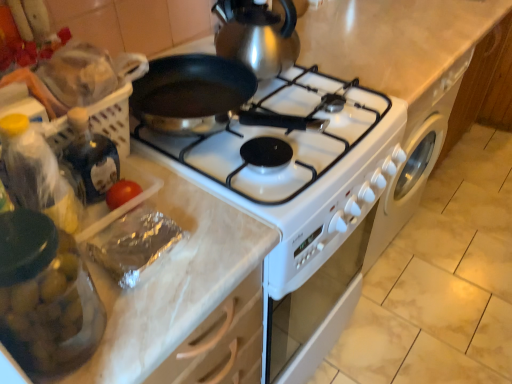
Question: Is translucent plastic bottle at left to the left of transparent glass jar at left from the viewer's perspective?

Choices:
 (A) yes
 (B) no

Answer: (A)

Question: Is translucent plastic bottle at left outside of transparent glass jar at left?

Choices:
 (A) no
 (B) yes

Answer: (B)

Question: Is transparent glass jar at left at the back of translucent plastic bottle at left?

Choices:
 (A) no
 (B) yes

Answer: (A)

Question: Does translucent plastic bottle at left have a lesser width compared to transparent glass jar at left?

Choices:
 (A) yes
 (B) no

Answer: (A)

Question: Is translucent plastic bottle at left not near transparent glass jar at left?

Choices:
 (A) yes
 (B) no

Answer: (B)

Question: In the image, is shiny metallic gas stove at center on the left side or the right side of transparent glass jar at left?

Choices:
 (A) right
 (B) left

Answer: (A)

Question: Considering the positions of point (304, 86) and point (11, 264), is point (304, 86) closer or farther from the camera than point (11, 264)?

Choices:
 (A) farther
 (B) closer

Answer: (A)

Question: Looking at their shapes, would you say shiny metallic gas stove at center is wider or thinner than transparent glass jar at left?

Choices:
 (A) thin
 (B) wide

Answer: (B)

Question: Would you say shiny metallic gas stove at center is inside or outside transparent glass jar at left?

Choices:
 (A) inside
 (B) outside

Answer: (B)

Question: Considering the positions of silver foil meat at lower left and shiny metallic gas stove at center in the image, is silver foil meat at lower left bigger or smaller than shiny metallic gas stove at center?

Choices:
 (A) small
 (B) big

Answer: (A)

Question: Would you say silver foil meat at lower left is to the left or to the right of shiny metallic gas stove at center in the picture?

Choices:
 (A) right
 (B) left

Answer: (B)

Question: In the image, is silver foil meat at lower left positioned in front of or behind shiny metallic gas stove at center?

Choices:
 (A) front
 (B) behind

Answer: (A)

Question: In terms of width, does silver foil meat at lower left look wider or thinner when compared to shiny metallic gas stove at center?

Choices:
 (A) wide
 (B) thin

Answer: (B)

Question: In terms of width, does translucent plastic bottle at left look wider or thinner when compared to silver foil meat at lower left?

Choices:
 (A) thin
 (B) wide

Answer: (A)

Question: Is translucent plastic bottle at left in front of or behind silver foil meat at lower left in the image?

Choices:
 (A) behind
 (B) front

Answer: (B)